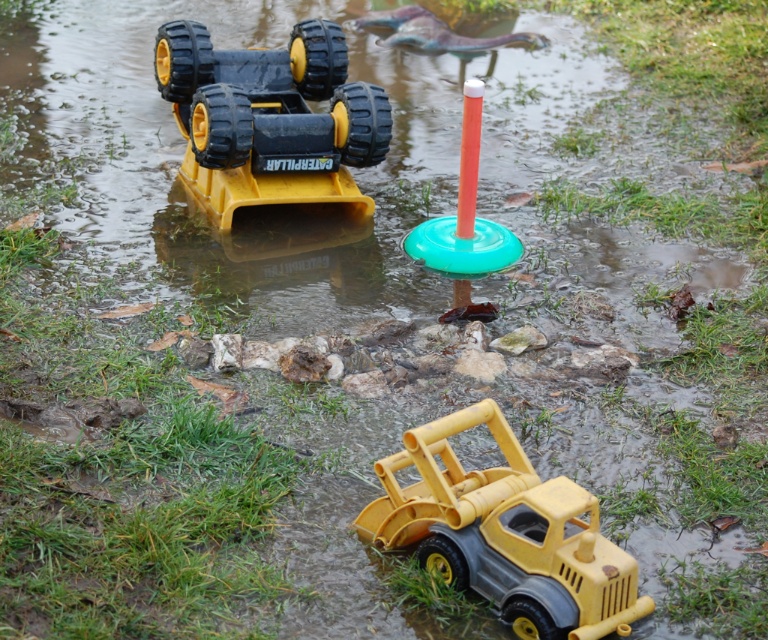
You are playing in a backyard and see the yellow plastic toy truck at lower center and the green plastic ring at center. Which object is located below the other?

The yellow plastic toy truck at lower center is positioned under the green plastic ring at center.

From the picture: You are a child trying to fit both the yellow plastic toy truck at lower center and the matte black caterpillar truck at upper left into a box that can only hold items narrower than the caterpillar truck. Which toy can fit?

The yellow plastic toy truck at lower center has a lesser width compared to the matte black caterpillar truck at upper left, so it can fit into the box.